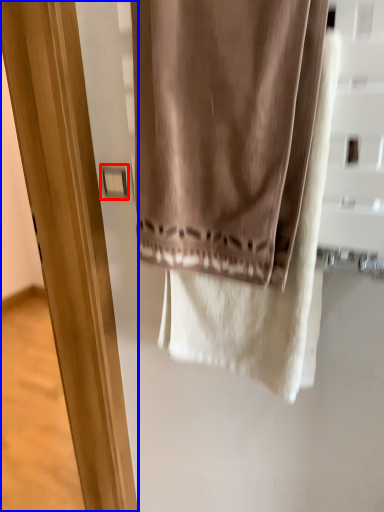
Question: Which of the following is the farthest to the observer, light switch (highlighted by a red box) or screen door (highlighted by a blue box)?

Choices:
 (A) light switch
 (B) screen door

Answer: (A)